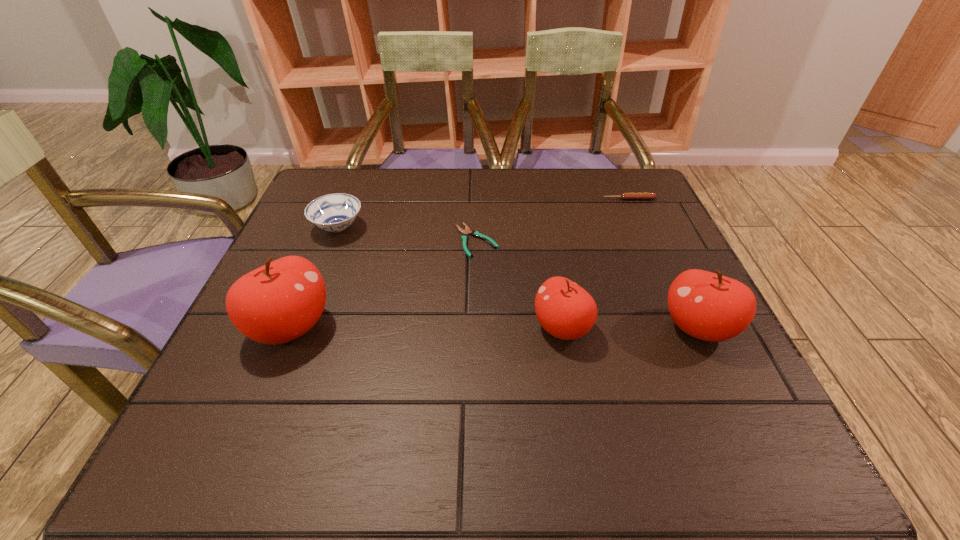
Locate an element on the screen. Image resolution: width=960 pixels, height=540 pixels. vacant space that's between the shortest object and the second tallest apple is located at coordinates click(x=588, y=284).

Locate which object is the second closest to the leftmost apple. Please provide its 2D coordinates. Your answer should be formatted as a tuple, i.e. [(x, y)], where the tuple contains the x and y coordinates of a point satisfying the conditions above.

[(467, 231)]

Locate an element on the screen. This screenshot has width=960, height=540. object that is the third closest to the fifth tallest object is located at coordinates (565, 310).

Select which apple is the second closest to the rightmost apple. Please provide its 2D coordinates. Your answer should be formatted as a tuple, i.e. [(x, y)], where the tuple contains the x and y coordinates of a point satisfying the conditions above.

[(276, 303)]

You are a GUI agent. You are given a task and a screenshot of the screen. Output one action in this format:
    pyautogui.click(x=<x>, y=<y>)
    Task: Click on the apple that is the third closest one to the sausage
    Image resolution: width=960 pixels, height=540 pixels.
    Given the screenshot: What is the action you would take?
    pyautogui.click(x=276, y=303)

This screenshot has width=960, height=540. Find the location of `vacant area in the image that satisfies the following two spatial constraints: 1. on the back side of the farthest object; 2. on the left side of the shortest object`. vacant area in the image that satisfies the following two spatial constraints: 1. on the back side of the farthest object; 2. on the left side of the shortest object is located at coordinates (477, 199).

Where is `blank area in the image that satisfies the following two spatial constraints: 1. on the back side of the leftmost apple; 2. on the left side of the soup bowl`? The height and width of the screenshot is (540, 960). blank area in the image that satisfies the following two spatial constraints: 1. on the back side of the leftmost apple; 2. on the left side of the soup bowl is located at coordinates (331, 228).

Locate an element on the screen. This screenshot has height=540, width=960. vacant space that satisfies the following two spatial constraints: 1. on the back side of the leftmost apple; 2. on the left side of the farthest object is located at coordinates (344, 199).

You are a GUI agent. You are given a task and a screenshot of the screen. Output one action in this format:
    pyautogui.click(x=<x>, y=<y>)
    Task: Click on the blank area in the image that satisfies the following two spatial constraints: 1. on the front side of the pliers; 2. on the right side of the soup bowl
    
    Given the screenshot: What is the action you would take?
    pyautogui.click(x=333, y=241)

This screenshot has height=540, width=960. Identify the location of blank space that satisfies the following two spatial constraints: 1. on the back side of the leftmost apple; 2. on the right side of the fourth tallest object. (331, 228).